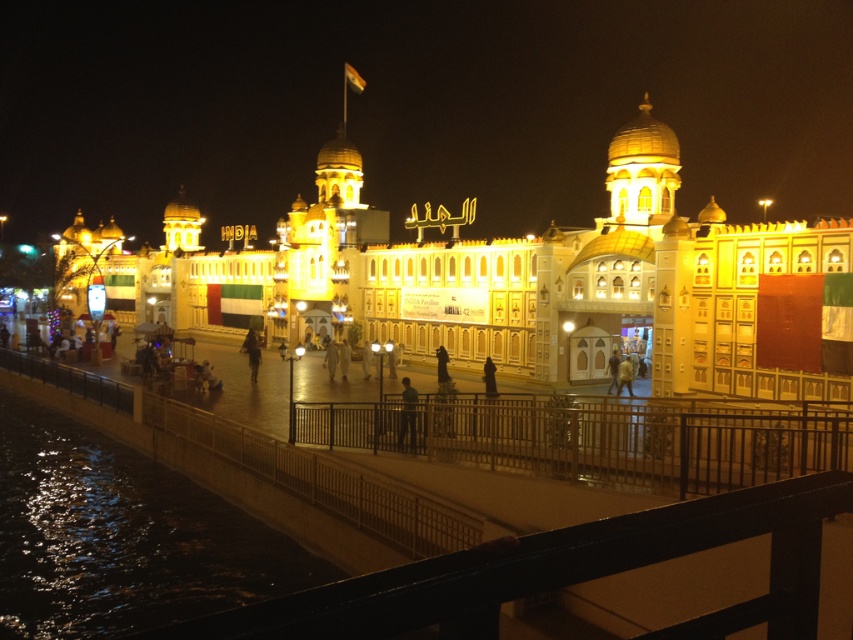
Question: Which of these objects is positioned closest to the metallic fence at lower center?

Choices:
 (A) light brown leather jacket at center
 (B) dark reflective water at lower left
 (C) dark matte clothing at center

Answer: (C)

Question: Observing the image, what is the correct spatial positioning of dark reflective water at lower left in reference to dark green fabric at center?

Choices:
 (A) below
 (B) above

Answer: (A)

Question: Which object appears farthest from the camera in this image?

Choices:
 (A) light brown leather jacket at center
 (B) dark matte clothing at center
 (C) dark blue fabric person at center

Answer: (C)

Question: Among these points, which one is farthest from the camera?

Choices:
 (A) (795, 436)
 (B) (610, 392)
 (C) (622, 362)
 (D) (169, 474)

Answer: (C)

Question: Is metallic fence at lower center positioned at the back of light brown leather jacket at center?

Choices:
 (A) yes
 (B) no

Answer: (B)

Question: Is metallic fence at lower center positioned behind dark green fabric at center?

Choices:
 (A) no
 (B) yes

Answer: (A)